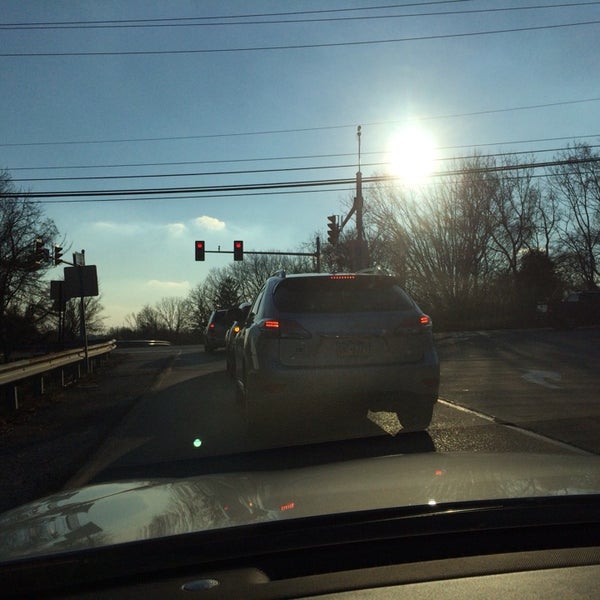
Identify the location of hood. The image size is (600, 600). (103, 524), (549, 475), (346, 470), (223, 488), (463, 464).